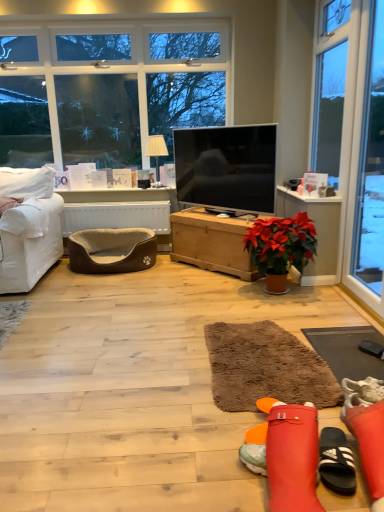
Question: Can you confirm if matte black tv at center is taller than brown shaggy rug at center, placed as the first flat when sorted from left to right?

Choices:
 (A) yes
 (B) no

Answer: (A)

Question: From the image's perspective, is matte black tv at center on top of brown shaggy rug at center, the 2th flat from the right?

Choices:
 (A) yes
 (B) no

Answer: (A)

Question: Is brown shaggy rug at center, placed as the first flat when sorted from left to right, completely or partially inside matte black tv at center?

Choices:
 (A) yes
 (B) no

Answer: (B)

Question: Is matte black tv at center at the right side of brown shaggy rug at center, the 2th flat from the right?

Choices:
 (A) yes
 (B) no

Answer: (B)

Question: From the image's perspective, is matte black tv at center located beneath brown shaggy rug at center, the 2th flat from the right?

Choices:
 (A) yes
 (B) no

Answer: (B)

Question: Is point (39, 242) closer or farther from the camera than point (165, 144)?

Choices:
 (A) farther
 (B) closer

Answer: (B)

Question: Is white fabric couch at left to the left or to the right of white fabric lampshade at upper center in the image?

Choices:
 (A) right
 (B) left

Answer: (B)

Question: Considering the positions of white fabric couch at left and white fabric lampshade at upper center in the image, is white fabric couch at left wider or thinner than white fabric lampshade at upper center?

Choices:
 (A) thin
 (B) wide

Answer: (B)

Question: Would you say white fabric couch at left is inside or outside white fabric lampshade at upper center?

Choices:
 (A) outside
 (B) inside

Answer: (A)

Question: In terms of size, does brown shaggy rug at center, the 2th flat from the right, appear bigger or smaller than brown fabric pet bed at left, which is the 2th table from right to left?

Choices:
 (A) small
 (B) big

Answer: (A)

Question: In the image, is brown shaggy rug at center, the 2th flat from the right, positioned in front of or behind brown fabric pet bed at left, which is the 2th table from right to left?

Choices:
 (A) behind
 (B) front

Answer: (B)

Question: Considering the positions of point (283, 361) and point (160, 188), is point (283, 361) closer or farther from the camera than point (160, 188)?

Choices:
 (A) closer
 (B) farther

Answer: (A)

Question: From a real-world perspective, is brown shaggy rug at center, the 2th flat from the right, above or below brown fabric pet bed at left, which is the 2th table from right to left?

Choices:
 (A) above
 (B) below

Answer: (B)

Question: From a real-world perspective, is matte black tv at center physically located above or below brown shaggy rug at lower right, which is counted as the 2th flat, starting from the left?

Choices:
 (A) below
 (B) above

Answer: (B)

Question: In terms of width, does matte black tv at center look wider or thinner when compared to brown shaggy rug at lower right, the first flat viewed from the right?

Choices:
 (A) thin
 (B) wide

Answer: (A)